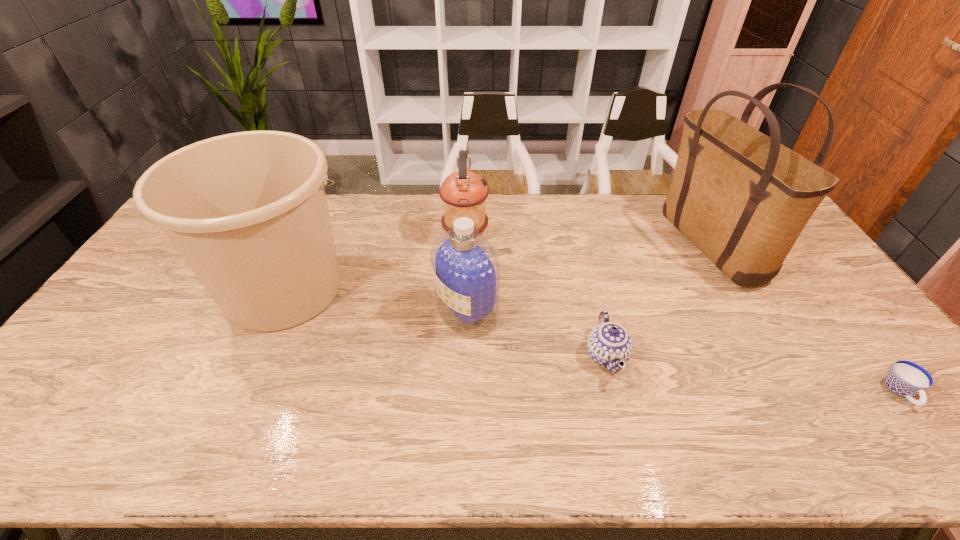
Find the location of a particular element. The width and height of the screenshot is (960, 540). unoccupied area between the rightmost object and the second shortest object is located at coordinates (754, 374).

You are a GUI agent. You are given a task and a screenshot of the screen. Output one action in this format:
    pyautogui.click(x=<x>, y=<y>)
    Task: Click on the free space between the fifth object from left to right and the cleansing agent
    Image resolution: width=960 pixels, height=540 pixels.
    Given the screenshot: What is the action you would take?
    pyautogui.click(x=588, y=278)

The image size is (960, 540). I want to click on vacant area between the cup and the fifth tallest object, so click(x=754, y=374).

Where is `empty space that is in between the shortest object and the fifth tallest object`? Image resolution: width=960 pixels, height=540 pixels. empty space that is in between the shortest object and the fifth tallest object is located at coordinates (754, 374).

Where is `free space between the cleansing agent and the fifth shortest object`? The image size is (960, 540). free space between the cleansing agent and the fifth shortest object is located at coordinates (375, 301).

What are the coordinates of `free space between the oil lamp and the fifth shortest object` in the screenshot? It's located at (374, 263).

Point out which object is positioned as the nearest to the tote bag. Please provide its 2D coordinates. Your answer should be formatted as a tuple, i.e. [(x, y)], where the tuple contains the x and y coordinates of a point satisfying the conditions above.

[(609, 345)]

Where is `object that is the fourth closest to the rightmost object`? The width and height of the screenshot is (960, 540). object that is the fourth closest to the rightmost object is located at coordinates (464, 193).

What are the coordinates of `free spot that satisfies the following two spatial constraints: 1. on the back side of the fifth object from left to right; 2. on the left side of the leftmost object` in the screenshot? It's located at (304, 245).